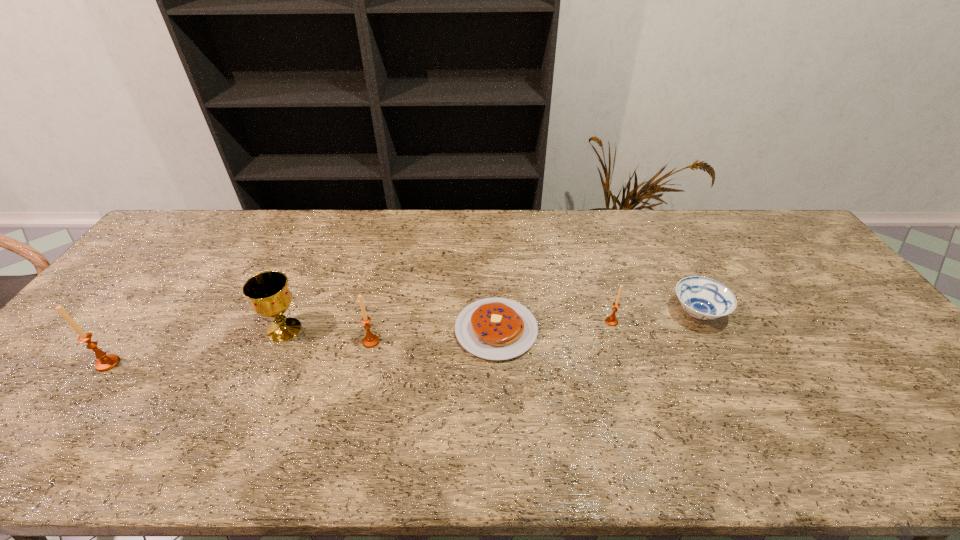
All candle_holders are currently evenly spaced. To continue this pattern, where would you add another candle_holder on the right? Please point out a vacant spot. Please provide its 2D coordinates. Your answer should be formatted as a tuple, i.e. [(x, y)], where the tuple contains the x and y coordinates of a point satisfying the conditions above.

[(832, 303)]